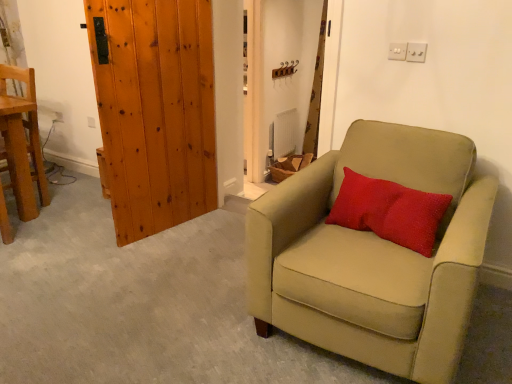
Locate an element on the screen. vacant space in front of wooden plank door at left is located at coordinates (162, 256).